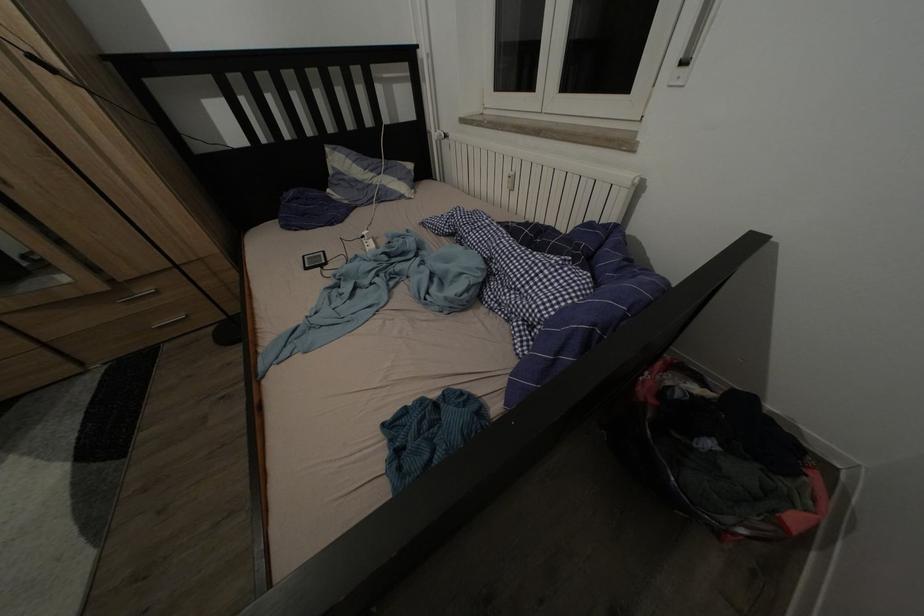
Which object does [313,260] point to?

This point indicates the small electronic device.